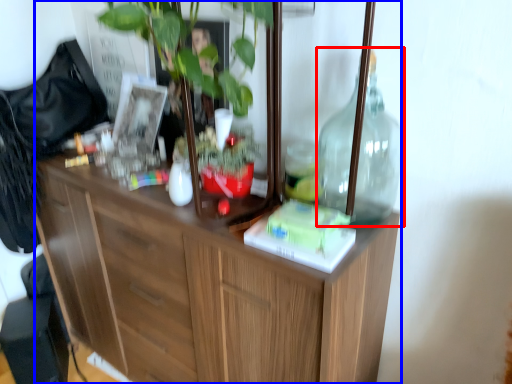
Question: Among these objects, which one is farthest to the camera, bottle (highlighted by a red box) or cabinetry (highlighted by a blue box)?

Choices:
 (A) bottle
 (B) cabinetry

Answer: (A)